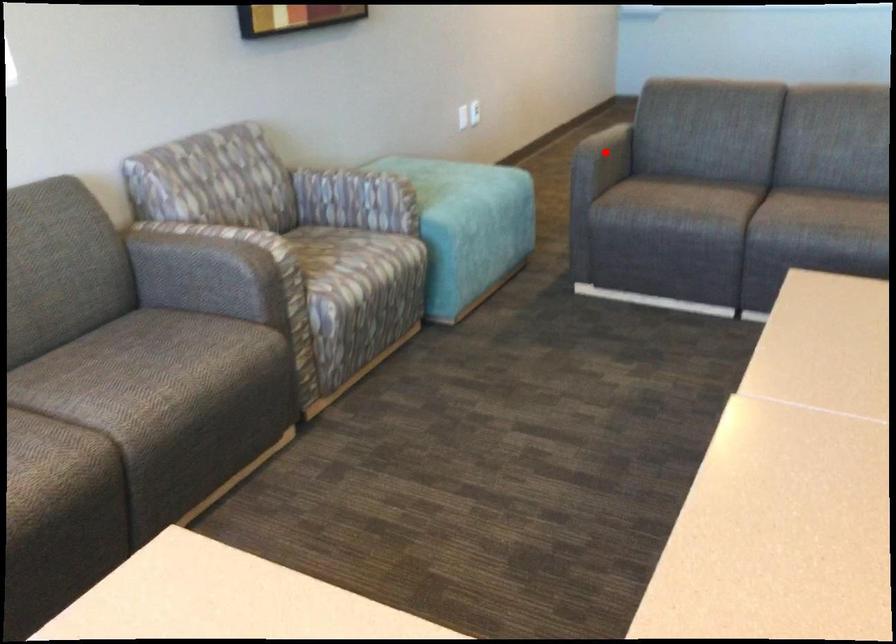
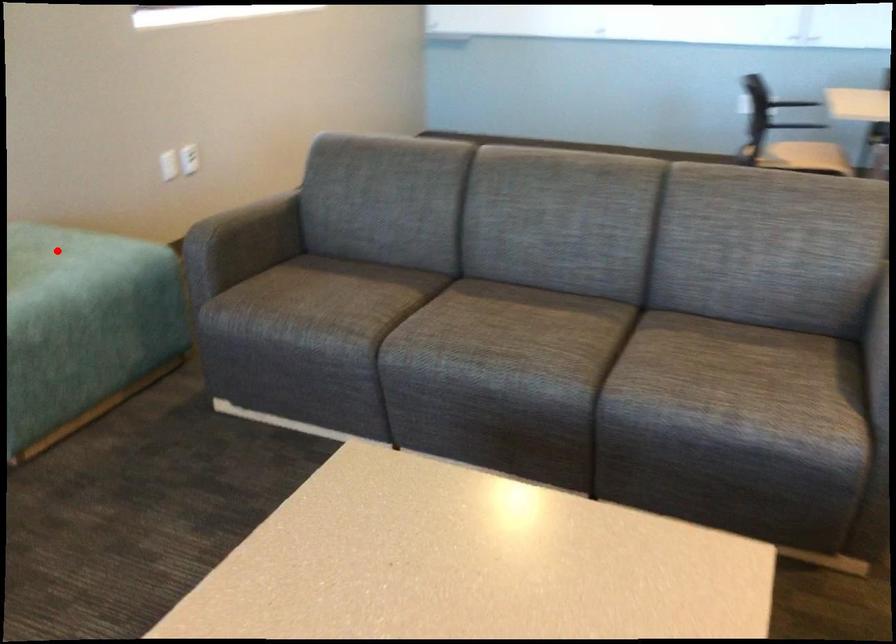
I am providing you with two images of the same scene from different viewpoints. A red point is marked on the first image and another point is marked on the second image. Is the red point in image1 aligned with the point shown in image2?

No